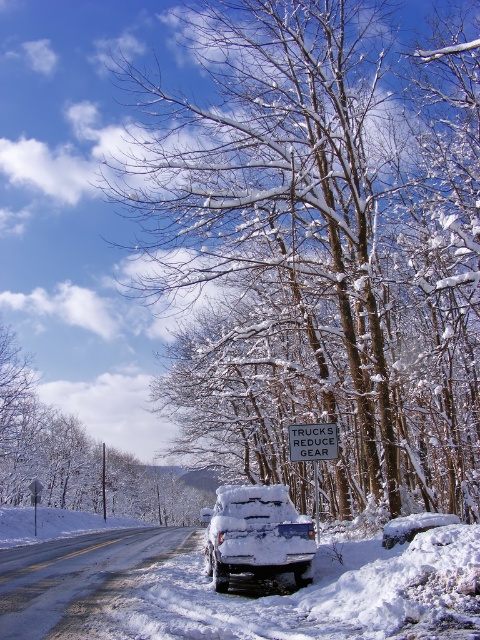
From the picture: You are driving a car and see two points on the road ahead. The first point is at coordinate point(408, 145) and the second is at point(322, 451). Which point is closer to your current position?

Point(322, 451) is closer to your current position because it is in front of point(408, 145), which is further back along the road.